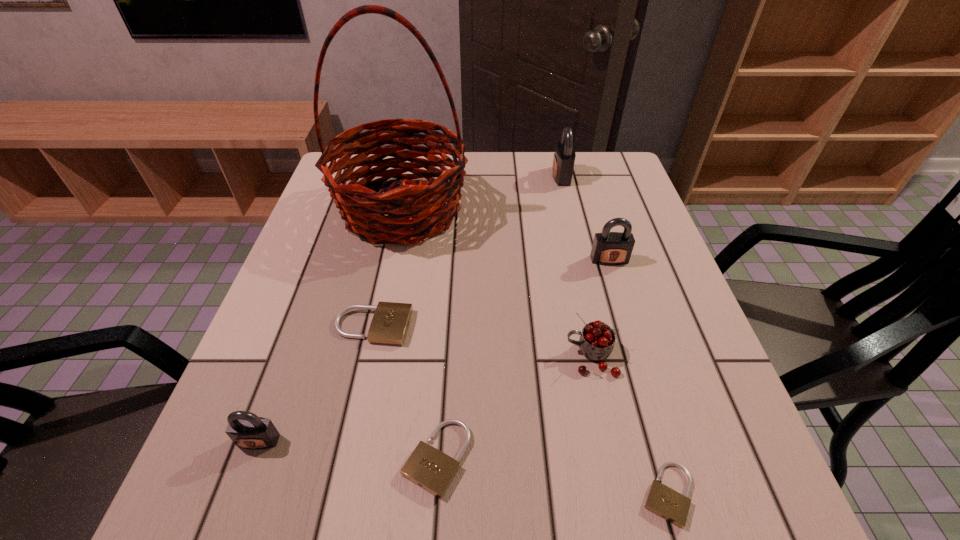
I want to click on object that is at the near right corner, so click(x=669, y=504).

You are a GUI agent. You are given a task and a screenshot of the screen. Output one action in this format:
    pyautogui.click(x=<x>, y=<y>)
    Task: Click on the vacant region at the far edge of the desktop
    This screenshot has width=960, height=540.
    Given the screenshot: What is the action you would take?
    pyautogui.click(x=554, y=153)

Where is `blank space at the near edge`? The width and height of the screenshot is (960, 540). blank space at the near edge is located at coordinates [x=469, y=522].

The image size is (960, 540). In the image, there is a desktop. Find the location of `vacant region at the left edge`. vacant region at the left edge is located at coordinates (246, 379).

At what (x,y) coordinates should I click in order to perform the action: click on vacant area at the right edge. Please return your answer as a coordinate pair (x, y). The height and width of the screenshot is (540, 960). Looking at the image, I should click on (706, 418).

In the image, there is a desktop. Where is `vacant area at the far right corner`? The height and width of the screenshot is (540, 960). vacant area at the far right corner is located at coordinates (594, 183).

The width and height of the screenshot is (960, 540). I want to click on free space at the near right corner of the desktop, so click(663, 473).

Where is `free space between the second smallest beige padlock and the second smallest gray padlock`? The height and width of the screenshot is (540, 960). free space between the second smallest beige padlock and the second smallest gray padlock is located at coordinates (523, 359).

Where is `free space between the fifth shortest padlock and the fourth padlock from right to left`? The height and width of the screenshot is (540, 960). free space between the fifth shortest padlock and the fourth padlock from right to left is located at coordinates (523, 359).

Locate an element on the screen. vacant area that lies between the shortest padlock and the tallest object is located at coordinates (535, 352).